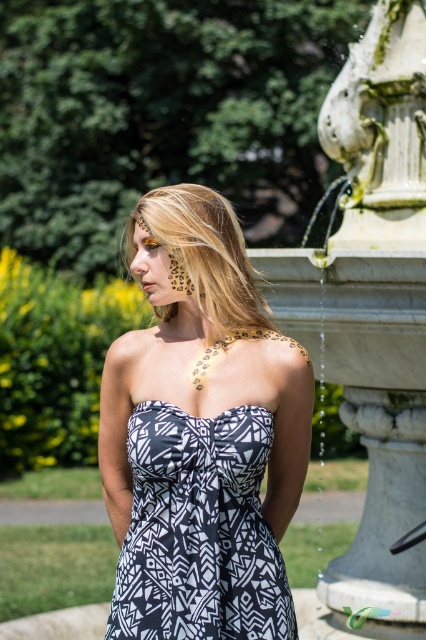
Question: Can you confirm if white marble fountain at right is smaller than leopard print skin at center?

Choices:
 (A) no
 (B) yes

Answer: (A)

Question: Among these points, which one is farthest from the camera?

Choices:
 (A) (183, 515)
 (B) (218, 289)
 (C) (348, 288)
 (D) (201, 584)

Answer: (C)

Question: Does white marble fountain at right appear on the right side of black and white printed dress at center?

Choices:
 (A) no
 (B) yes

Answer: (B)

Question: Which point is closer to the camera?

Choices:
 (A) (281, 339)
 (B) (351, 257)
 (C) (173, 308)

Answer: (A)

Question: Which of the following is the closest to the observer?

Choices:
 (A) white marble fountain at right
 (B) black and white printed dress at center

Answer: (B)

Question: Is black and white printed dress at center positioned before blonde hair at center?

Choices:
 (A) yes
 (B) no

Answer: (A)